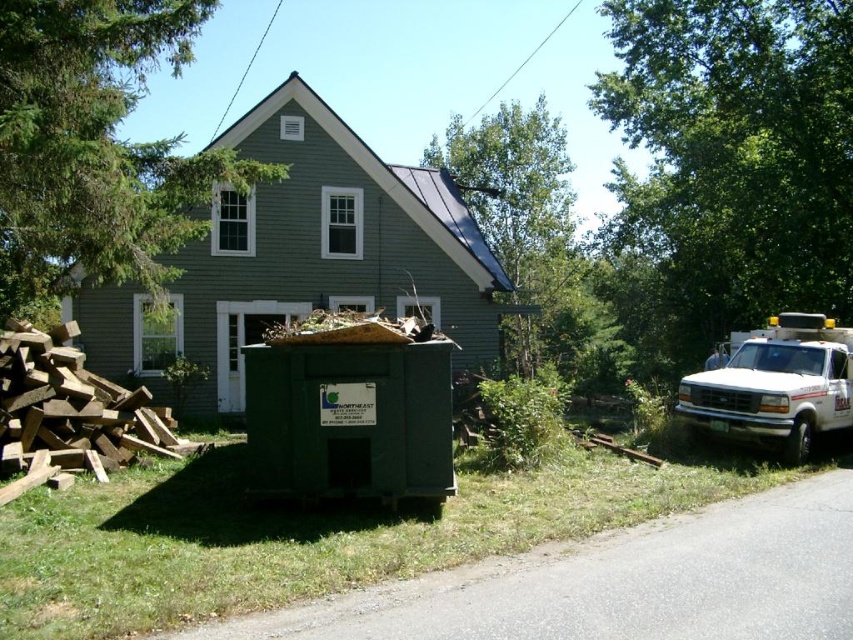
You are a delivery driver approaching the house and see the white glossy truck at right and the green leafy tree at upper center. Which object is closer to the house?

The green leafy tree at upper center is closer to the house because the white glossy truck at right is behind it, indicating the tree is in front and nearer to the house.

You are standing in front of the house and notice the green leafy tree at upper center and the brown rough wood at lower left. Which object is taller?

The green leafy tree at upper center is taller than the brown rough wood at lower left according to the description.